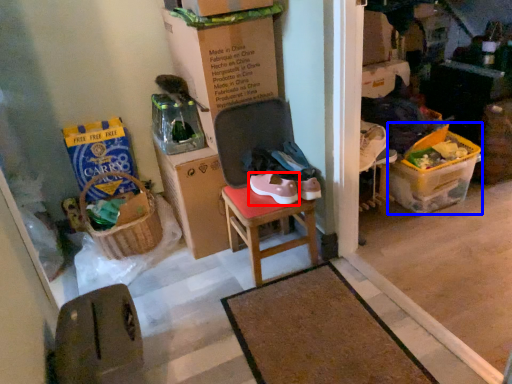
Question: Which object appears closest to the camera in this image, footwear (highlighted by a red box) or box (highlighted by a blue box)?

Choices:
 (A) footwear
 (B) box

Answer: (A)